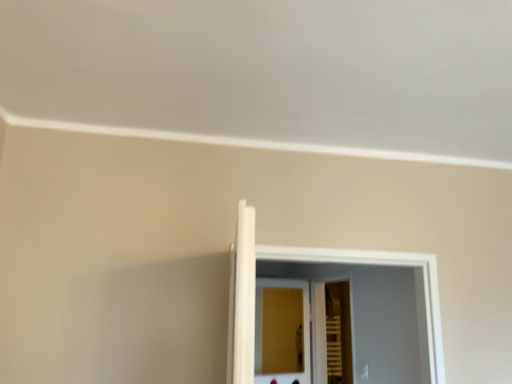
Question: Can you confirm if wooden slats at center, the 2th screen door positioned from the left, is taller than wooden screen door at center, which appears as the 2th screen door when viewed from the right?

Choices:
 (A) no
 (B) yes

Answer: (B)

Question: Considering the relative positions of wooden slats at center, which is the 1th screen door in right-to-left order, and wooden screen door at center, marked as the first screen door in a left-to-right arrangement, in the image provided, is wooden slats at center, which is the 1th screen door in right-to-left order, in front of wooden screen door at center, marked as the first screen door in a left-to-right arrangement,?

Choices:
 (A) yes
 (B) no

Answer: (A)

Question: Considering the relative sizes of wooden slats at center, the 2th screen door positioned from the left, and wooden screen door at center, marked as the first screen door in a left-to-right arrangement, in the image provided, is wooden slats at center, the 2th screen door positioned from the left, thinner than wooden screen door at center, marked as the first screen door in a left-to-right arrangement,?

Choices:
 (A) yes
 (B) no

Answer: (B)

Question: From a real-world perspective, is wooden slats at center, the 2th screen door positioned from the left, on wooden screen door at center, which appears as the 2th screen door when viewed from the right?

Choices:
 (A) no
 (B) yes

Answer: (B)

Question: Can you confirm if wooden slats at center, which is the 1th screen door in right-to-left order, is wider than wooden screen door at center, marked as the first screen door in a left-to-right arrangement?

Choices:
 (A) no
 (B) yes

Answer: (B)

Question: Does wooden slats at center, the 2th screen door positioned from the left, have a smaller size compared to wooden screen door at center, which appears as the 2th screen door when viewed from the right?

Choices:
 (A) no
 (B) yes

Answer: (A)

Question: Considering the relative sizes of wooden screen door at center, marked as the first screen door in a left-to-right arrangement, and wooden slats at center, the 2th screen door positioned from the left, in the image provided, is wooden screen door at center, marked as the first screen door in a left-to-right arrangement, bigger than wooden slats at center, the 2th screen door positioned from the left,?

Choices:
 (A) yes
 (B) no

Answer: (B)

Question: Is wooden screen door at center, which appears as the 2th screen door when viewed from the right, behind wooden slats at center, the 2th screen door positioned from the left?

Choices:
 (A) yes
 (B) no

Answer: (A)

Question: Is wooden screen door at center, which appears as the 2th screen door when viewed from the right, aimed at wooden slats at center, the 2th screen door positioned from the left?

Choices:
 (A) yes
 (B) no

Answer: (A)

Question: Considering the relative sizes of wooden screen door at center, which appears as the 2th screen door when viewed from the right, and wooden slats at center, which is the 1th screen door in right-to-left order, in the image provided, is wooden screen door at center, which appears as the 2th screen door when viewed from the right, wider than wooden slats at center, which is the 1th screen door in right-to-left order,?

Choices:
 (A) no
 (B) yes

Answer: (A)

Question: Is wooden screen door at center, marked as the first screen door in a left-to-right arrangement, shorter than wooden slats at center, the 2th screen door positioned from the left?

Choices:
 (A) yes
 (B) no

Answer: (A)

Question: Is wooden screen door at center, marked as the first screen door in a left-to-right arrangement, not within wooden slats at center, the 2th screen door positioned from the left?

Choices:
 (A) no
 (B) yes

Answer: (B)

Question: Which is correct: wooden slats at center, which is the 1th screen door in right-to-left order, is inside wooden screen door at center, marked as the first screen door in a left-to-right arrangement, or outside of it?

Choices:
 (A) inside
 (B) outside

Answer: (B)